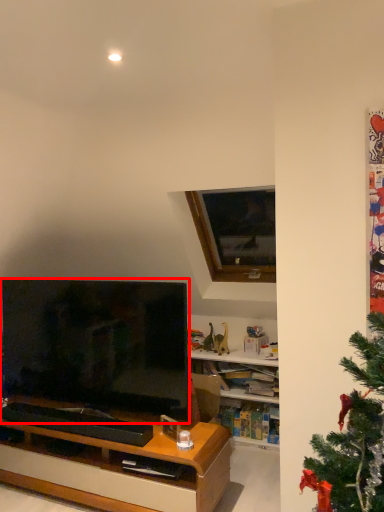
Question: Where is television (annotated by the red box) located in relation to window in the image?

Choices:
 (A) right
 (B) left

Answer: (B)